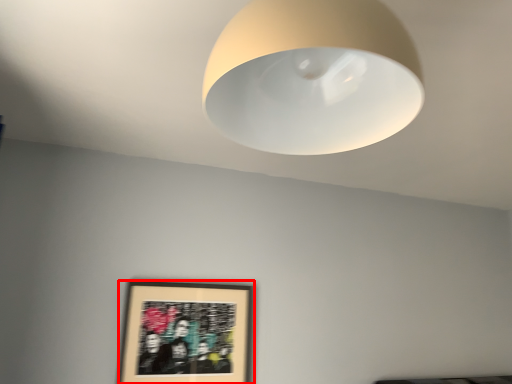
Question: Observing the image, what is the correct spatial positioning of picture frame (annotated by the red box) in reference to lamp?

Choices:
 (A) left
 (B) right

Answer: (A)